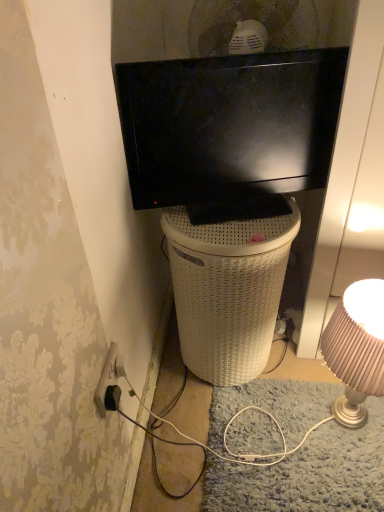
Question: From their relative heights in the image, would you say black glossy tv at upper center is taller or shorter than matte gold lampshade at right?

Choices:
 (A) tall
 (B) short

Answer: (B)

Question: In the image, is black glossy tv at upper center positioned in front of or behind matte gold lampshade at right?

Choices:
 (A) front
 (B) behind

Answer: (A)

Question: Estimate the real-world distances between objects in this image. Which object is closer to the black glossy tv at upper center?

Choices:
 (A) matte gold lampshade at right
 (B) black plastic power outlet at lower left
 (C) white wicker trash bin/can at center

Answer: (C)

Question: Which object is positioned closest to the matte gold lampshade at right?

Choices:
 (A) black plastic power outlet at lower left
 (B) black glossy tv at upper center
 (C) white wicker trash bin/can at center

Answer: (C)